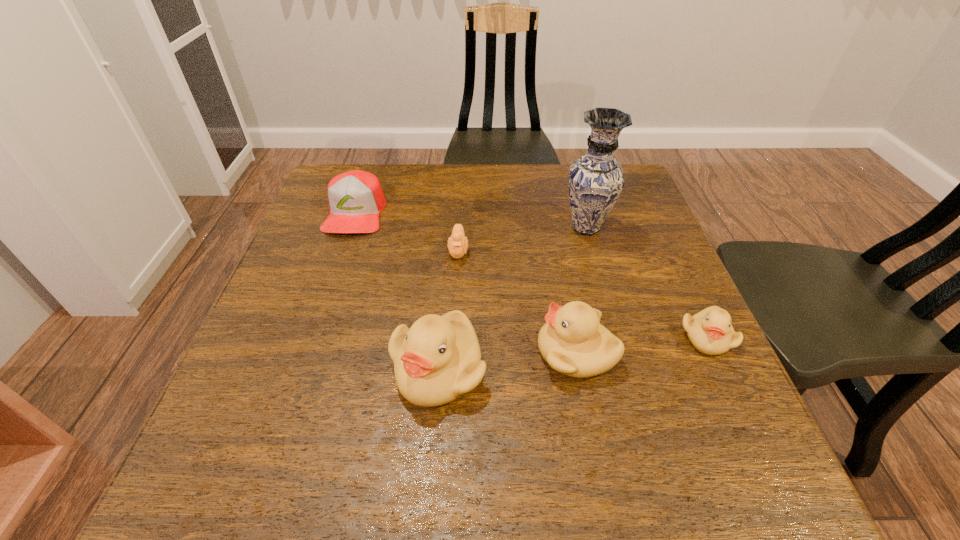
You are a GUI agent. You are given a task and a screenshot of the screen. Output one action in this format:
    pyautogui.click(x=<x>, y=<y>)
    Task: Click on the object that is the fourth closest to the fourth shortest object
    The height and width of the screenshot is (540, 960).
    Given the screenshot: What is the action you would take?
    (x=596, y=180)

Identify which object is located as the second nearest to the third duckling from left to right. Please provide its 2D coordinates. Your answer should be formatted as a tuple, i.e. [(x, y)], where the tuple contains the x and y coordinates of a point satisfying the conditions above.

[(710, 331)]

Select which duckling appears as the second closest to the rightmost object. Please provide its 2D coordinates. Your answer should be formatted as a tuple, i.e. [(x, y)], where the tuple contains the x and y coordinates of a point satisfying the conditions above.

[(437, 360)]

The height and width of the screenshot is (540, 960). Identify the location of duckling object that ranks as the third closest to the second tallest duckling. (457, 244).

Find the location of a particular element. The image size is (960, 540). free location that satisfies the following two spatial constraints: 1. on the beak of the rightmost object; 2. on the beak of the third shortest duckling is located at coordinates (713, 353).

Identify the location of blank space that satisfies the following two spatial constraints: 1. on the front-facing side of the vase; 2. on the left side of the leftmost object. The width and height of the screenshot is (960, 540). (350, 228).

Identify the location of vacant space that satisfies the following two spatial constraints: 1. on the front-facing side of the vase; 2. on the left side of the baseball cap. click(x=350, y=228).